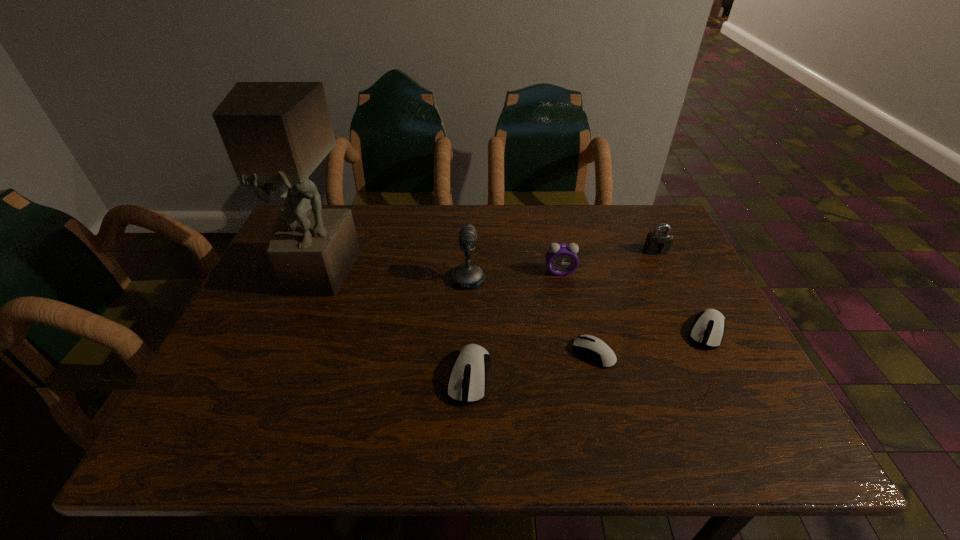
Please point a vacant point for placing a mouse on the left. Please provide its 2D coordinates. Your answer should be formatted as a tuple, i.e. [(x, y)], where the tuple contains the x and y coordinates of a point satisfying the conditions above.

[(332, 402)]